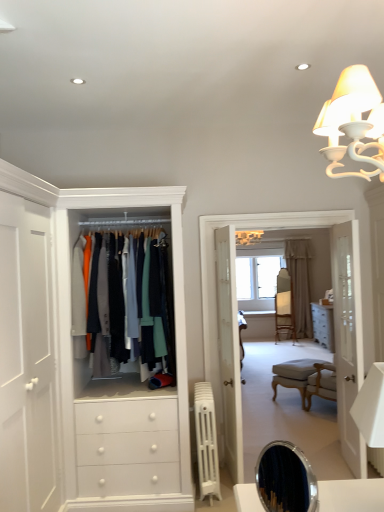
Describe the element at coordinates (294, 377) in the screenshot. I see `white leather ottoman at lower right` at that location.

In order to face white plastic radiator at center, should I rotate leftwards or rightwards?

A 1.811 degree turn to the right will do.

Identify the location of wooden armchair at center. (284, 314).

The width and height of the screenshot is (384, 512). I want to click on white glass door at right, so click(348, 339).

Where is `matte fabric jackets at center`? This screenshot has height=512, width=384. matte fabric jackets at center is located at coordinates (127, 294).

From the image's perspective, relative to white glass door at right, is white plastic radiator at center above or below?

From the image's perspective, white plastic radiator at center appears below white glass door at right.

At what (x,y) coordinates should I click in order to perform the action: click on radiator in front of the white glass door at right. Please return your answer as a coordinate pair (x, y). Image resolution: width=384 pixels, height=512 pixels. Looking at the image, I should click on (206, 441).

From a real-world perspective, between white plastic radiator at center and white glass door at right, who is vertically lower?

In real-world perspective, white plastic radiator at center is lower.

Which is more to the right, white plastic radiator at center or white glass door at right?

Positioned to the right is white glass door at right.

Is beige fabric curtain at center completely or partially outside of wooden floor at center?

Yes, beige fabric curtain at center is outside of wooden floor at center.

Is beige fabric curtain at center smaller than wooden floor at center?

Yes.

From a real-world perspective, which object stands above the other?

From a 3D spatial view, wooden floor at center is above.

How different are the orientations of beige fabric curtain at center and wooden floor at center in degrees?

The angle between the facing direction of beige fabric curtain at center and the facing direction of wooden floor at center is 1.42 degrees.

From the picture: Are white leather ottoman at lower right and wooden floor at center far apart?

Absolutely, white leather ottoman at lower right is distant from wooden floor at center.

Does white leather ottoman at lower right come behind wooden floor at center?

Yes, the depth of white leather ottoman at lower right is greater than that of wooden floor at center.

Can you confirm if white leather ottoman at lower right is thinner than wooden floor at center?

In fact, white leather ottoman at lower right might be wider than wooden floor at center.

Is wooden floor at center at the back of white leather ottoman at lower right?

white leather ottoman at lower right is not turned away from wooden floor at center.

Does wooden floor at center appear on the left side of white plastic radiator at center?

Incorrect, wooden floor at center is not on the left side of white plastic radiator at center.

How much distance is there between wooden floor at center and white plastic radiator at center?

wooden floor at center is 30.72 inches away from white plastic radiator at center.

Find the location of `radiator below the wooden floor at center (from the image's perspective)`. radiator below the wooden floor at center (from the image's perspective) is located at coordinates (206, 441).

Which is nearer, (203, 336) or (200, 382)?

Point (203, 336) is positioned farther from the camera compared to point (200, 382).

In the scene shown: From a real-world perspective, who is located lower, white plastic radiator at center or wooden armchair at center?

From a 3D spatial view, white plastic radiator at center is below.

Is the position of white plastic radiator at center more distant than that of wooden armchair at center?

No, it is in front of wooden armchair at center.

Is white plastic radiator at center positioned far away from wooden armchair at center?

Indeed, white plastic radiator at center is not near wooden armchair at center.

How many degrees apart are the facing directions of beige fabric curtain at center and white glass door at right?

beige fabric curtain at center and white glass door at right are facing 91.3 degrees away from each other.

Is beige fabric curtain at center placed right next to white glass door at right?

There is a gap between beige fabric curtain at center and white glass door at right.

Can you confirm if beige fabric curtain at center is bigger than white glass door at right?

Yes, beige fabric curtain at center is bigger than white glass door at right.

Is beige fabric curtain at center facing towards white glass door at right?

Yes, beige fabric curtain at center is oriented towards white glass door at right.

Which is more to the right, matte fabric jackets at center or white glass door at right?

Positioned to the right is white glass door at right.

From a real-world perspective, does matte fabric jackets at center stand above white glass door at right?

Correct, in the physical world, matte fabric jackets at center is higher than white glass door at right.

From the image's perspective, is matte fabric jackets at center on white glass door at right?

Yes, from the image's perspective, matte fabric jackets at center is over white glass door at right.

Is point (159, 259) positioned in front of point (347, 453)?

No.

Locate an element on the screen. door behind the white plastic radiator at center is located at coordinates (348, 339).

Locate an element on the screen. Image resolution: width=384 pixels, height=512 pixels. boutique to the left of beige fabric curtain at center is located at coordinates (266, 228).

Based on the photo, estimate the real-world distances between objects in this image. Which object is closer to white plastic radiator at center, white glass door at right or matte fabric jackets at center?

matte fabric jackets at center lies closer to white plastic radiator at center than the other object.

When comparing their distances from white glass door at right, does wooden armchair at center or beige fabric curtain at center seem further?

Among the two, wooden armchair at center is located further to white glass door at right.

Estimate the real-world distances between objects in this image. Which object is closer to white glass door at right, matte fabric jackets at center or wooden floor at center?

Based on the image, wooden floor at center appears to be nearer to white glass door at right.

Considering their positions, is white plastic radiator at center positioned further to beige fabric curtain at center than matte fabric jackets at center?

Based on the image, matte fabric jackets at center appears to be further to beige fabric curtain at center.

Based on the photo, considering their positions, is white plastic radiator at center positioned further to wooden floor at center than wooden armchair at center?

wooden armchair at center is positioned further to the anchor wooden floor at center.

Which object lies nearer to the anchor point white plastic radiator at center, matte fabric jackets at center or wooden armchair at center?

matte fabric jackets at center is closer to white plastic radiator at center.

Looking at the image, which one is located closer to matte fabric jackets at center, white plastic radiator at center or beige fabric curtain at center?

white plastic radiator at center lies closer to matte fabric jackets at center than the other object.

When comparing their distances from wooden floor at center, does matte fabric jackets at center or wooden armchair at center seem closer?

Based on the image, matte fabric jackets at center appears to be nearer to wooden floor at center.

You are a GUI agent. You are given a task and a screenshot of the screen. Output one action in this format:
    pyautogui.click(x=<x>, y=<y>)
    Task: Click on the vanity positioned between wooden floor at center and wooden armchair at center from near to far
    The height and width of the screenshot is (512, 384).
    Given the screenshot: What is the action you would take?
    pyautogui.click(x=294, y=377)

The height and width of the screenshot is (512, 384). I want to click on door located between matte fabric jackets at center and beige fabric curtain at center in the depth direction, so click(348, 339).

Image resolution: width=384 pixels, height=512 pixels. Identify the location of boutique located between matte fabric jackets at center and beige fabric curtain at center in the depth direction. (266, 228).

Locate an element on the screen. This screenshot has width=384, height=512. boutique between white plastic radiator at center and white glass door at right in the horizontal direction is located at coordinates (266, 228).